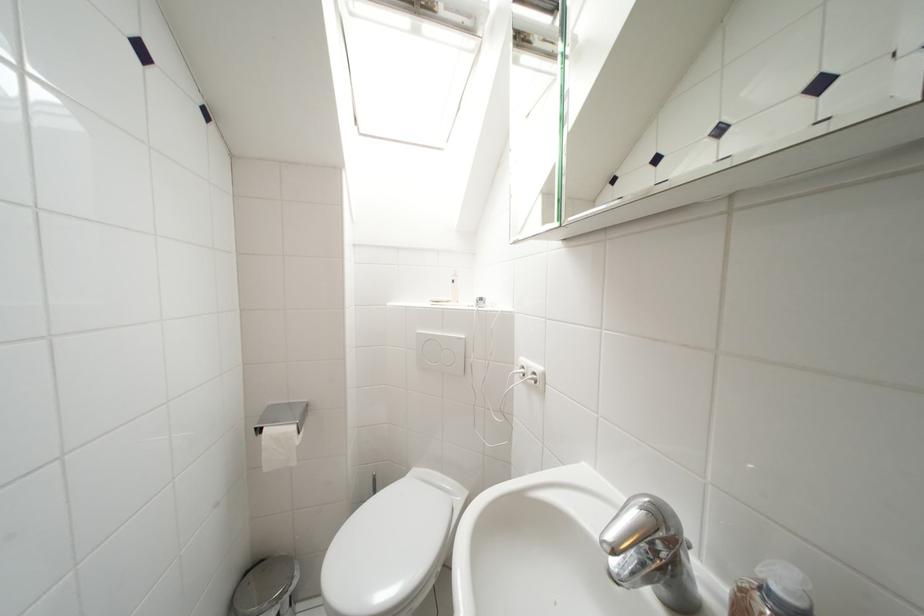
The height and width of the screenshot is (616, 924). Describe the element at coordinates (440, 352) in the screenshot. I see `the large flush button` at that location.